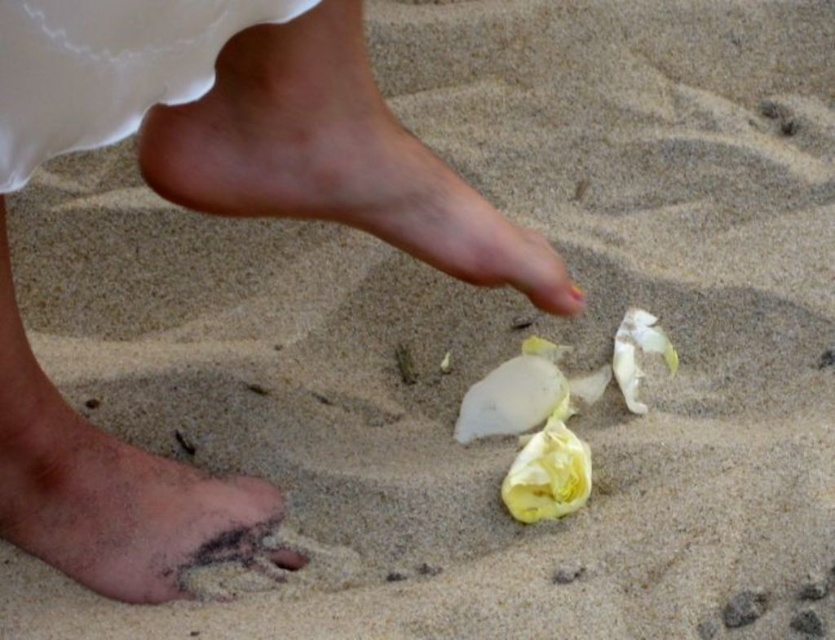
Measure the distance between point (338, 56) and camera.

A distance of 84.81 centimeters exists between point (338, 56) and camera.

Which is in front, point (387, 168) or point (367, 106)?

Point (367, 106) is in front.

Does point (276, 196) lie in front of point (262, 209)?

That is True.

Image resolution: width=835 pixels, height=640 pixels. What are the coordinates of `smooth skin foot at lower left` in the screenshot? It's located at (334, 157).

This screenshot has height=640, width=835. Describe the element at coordinates (334, 157) in the screenshot. I see `smooth skin foot at lower left` at that location.

Who is positioned more to the left, smooth skin foot at lower left or brown sandy foot at lower left?

Positioned to the left is brown sandy foot at lower left.

Measure the distance between point (257, 72) and camera.

They are 32.28 inches apart.

What are the coordinates of `smooth skin foot at lower left` in the screenshot? It's located at (334, 157).

Between point (468, 243) and point (171, 483), which one is positioned behind?

The point (171, 483) is behind.

Who is taller, pink skin at center or brown sandy foot at lower left?

pink skin at center is taller.

Is point (209, 92) more distant than point (143, 564)?

No, (209, 92) is closer to viewer.

This screenshot has width=835, height=640. Identify the location of pink skin at center. (334, 157).